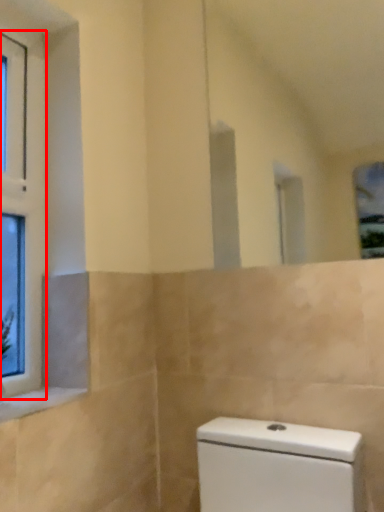
Question: From the image's perspective, where is window (annotated by the red box) located relative to window sill?

Choices:
 (A) below
 (B) above

Answer: (B)